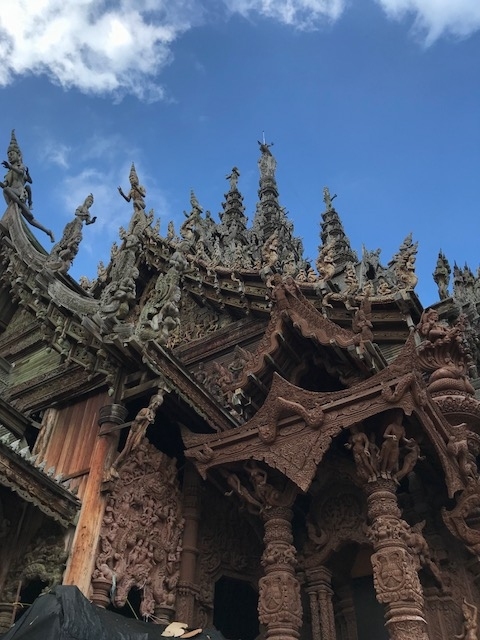
Where is `column`? column is located at coordinates (273, 582), (406, 578).